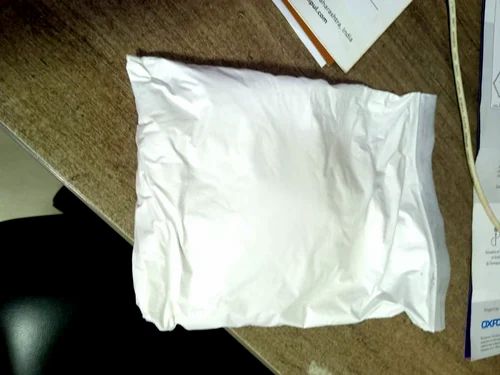
What are the coordinates of `pillow corner` in the screenshot? It's located at (128, 56), (434, 97), (441, 327).